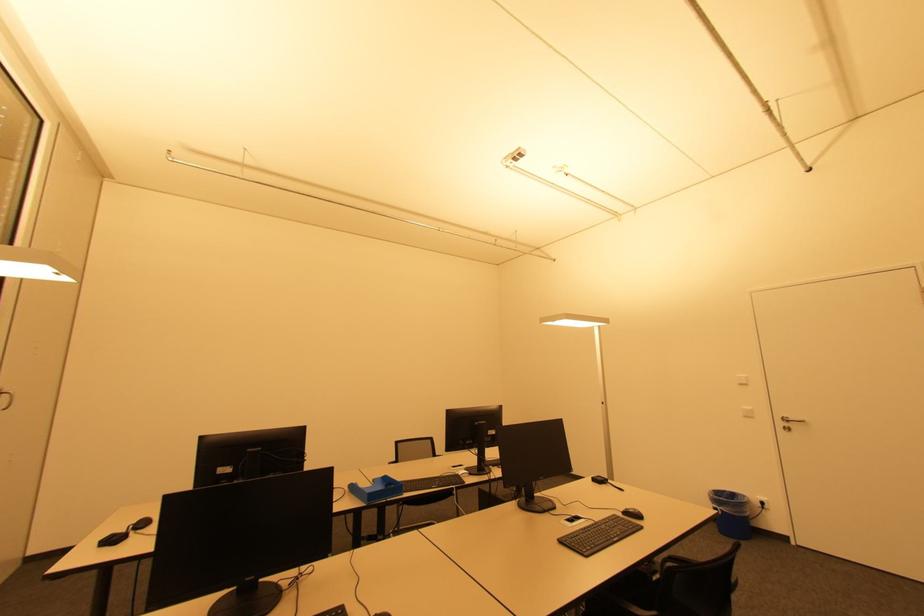
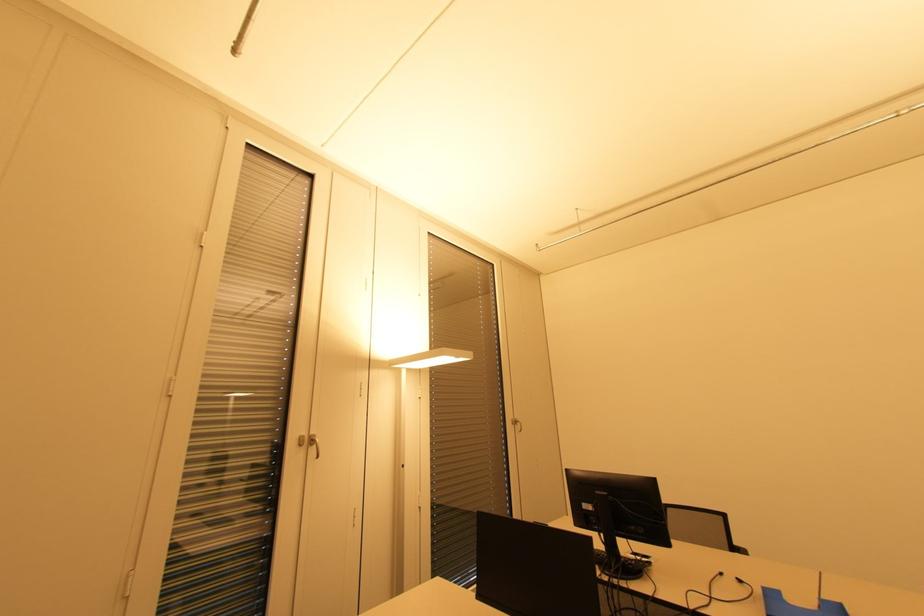
Question: Based on the continuous images, in which direction is the camera rotating? Reply with the corresponding letter.

Choices:
 (A) Left
 (B) Right
 (C) Up
 (D) Down

Answer: (A)